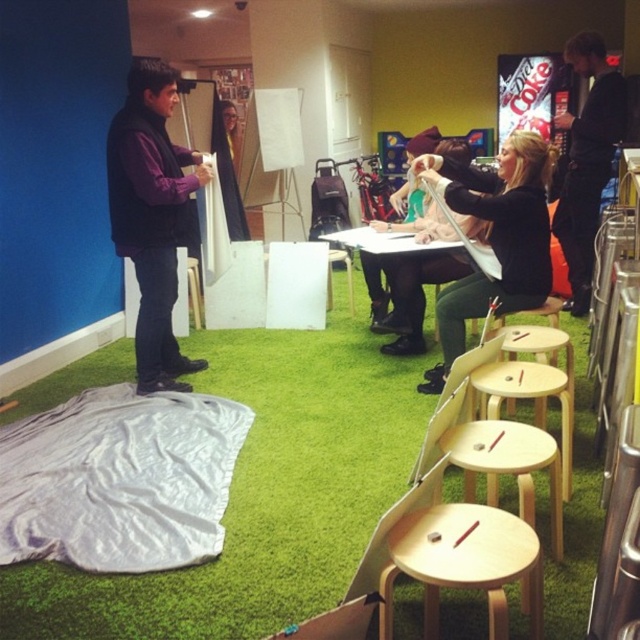
Which is behind, point (580, 566) or point (138, 385)?

The point (138, 385) is more distant.

Describe the element at coordinates (259, 497) in the screenshot. This screenshot has height=640, width=640. I see `green artificial turf at center` at that location.

The width and height of the screenshot is (640, 640). Find the location of `green artificial turf at center`. green artificial turf at center is located at coordinates (259, 497).

Who is taller, green artificial turf at center or wooden stool at center?

Standing taller between the two is green artificial turf at center.

This screenshot has width=640, height=640. Find the location of `green artificial turf at center`. green artificial turf at center is located at coordinates (259, 497).

Is point (74, 580) in front of point (189, 294)?

Yes, it is in front of point (189, 294).

Identify the location of green artificial turf at center. (259, 497).

Describe the element at coordinates (150, 216) in the screenshot. I see `purple fleece vest at center` at that location.

Does purple fleece vest at center have a lesser width compared to wooden stool at center?

Incorrect, purple fleece vest at center's width is not less than wooden stool at center's.

Describe the element at coordinates (150, 216) in the screenshot. I see `purple fleece vest at center` at that location.

Where is `purple fleece vest at center`? The height and width of the screenshot is (640, 640). purple fleece vest at center is located at coordinates (150, 216).